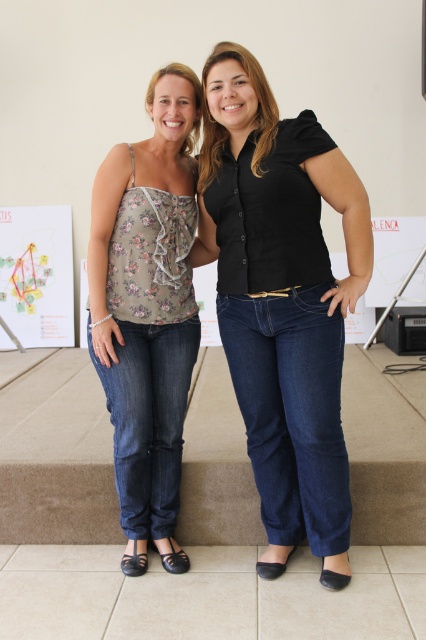
Between black matte shirt at center and floral print fabric top at center, which one appears on the right side from the viewer's perspective?

From the viewer's perspective, black matte shirt at center appears more on the right side.

Who is more distant from viewer, (x=224, y=328) or (x=169, y=138)?

The point (x=169, y=138) is behind.

Is point (239, 132) closer to camera compared to point (143, 540)?

Yes.

Locate an element on the screen. black matte shirt at center is located at coordinates (282, 300).